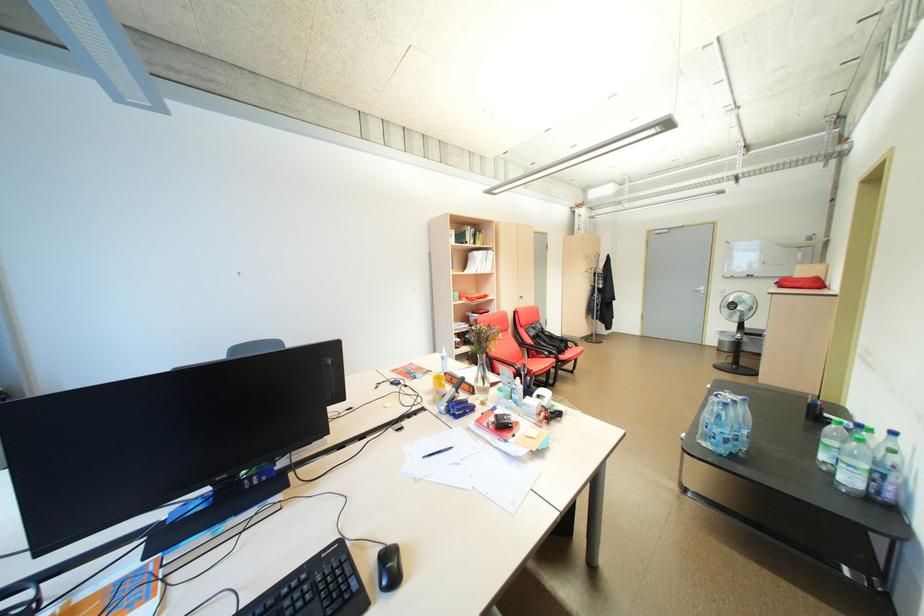
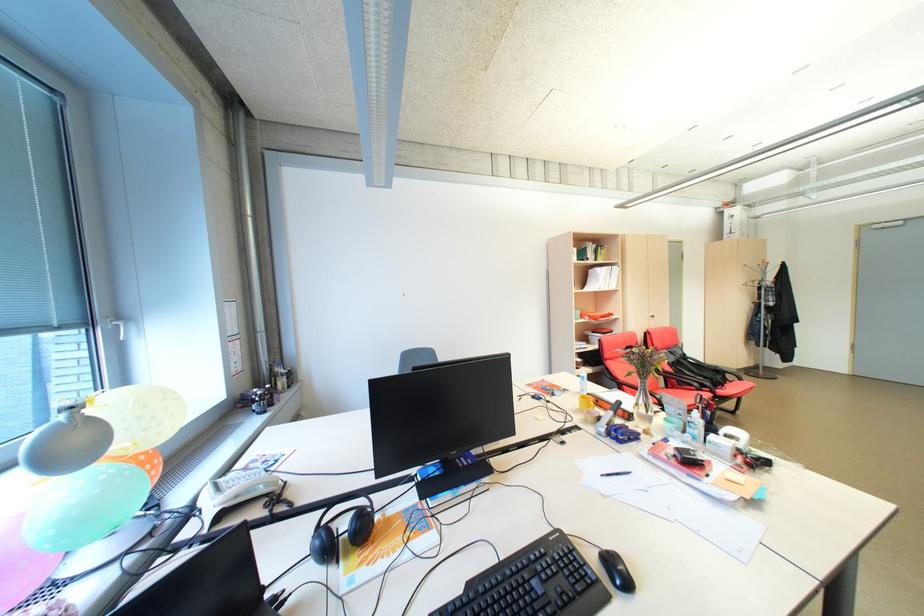
Locate, in the second image, the point that corresponds to [525,313] in the first image.

(655, 334)